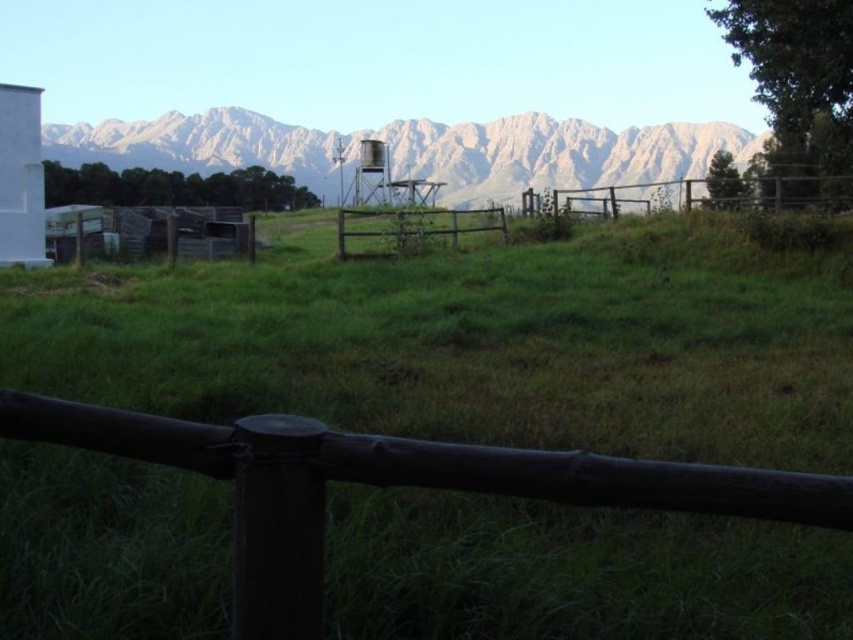
Is dark wood fence at center taller than metallic gray water tower at center?

No, dark wood fence at center is not taller than metallic gray water tower at center.

Image resolution: width=853 pixels, height=640 pixels. What do you see at coordinates (389, 484) in the screenshot? I see `dark wood fence at center` at bounding box center [389, 484].

The height and width of the screenshot is (640, 853). I want to click on dark wood fence at center, so [389, 484].

Does gray rocky mountain range at upper center lie in front of metallic gray water tower at center?

No.

Which is more to the right, gray rocky mountain range at upper center or metallic gray water tower at center?

metallic gray water tower at center is more to the right.

Find the location of a particular element. This screenshot has height=640, width=853. gray rocky mountain range at upper center is located at coordinates (412, 150).

Is dark wood fence at center thinner than gray rocky mountain range at upper center?

Yes.

Which is above, dark wood fence at center or gray rocky mountain range at upper center?

Positioned higher is gray rocky mountain range at upper center.

Does point (80, 436) come behind point (318, 134)?

No, (80, 436) is in front of (318, 134).

Where is `dark wood fence at center`? dark wood fence at center is located at coordinates (389, 484).